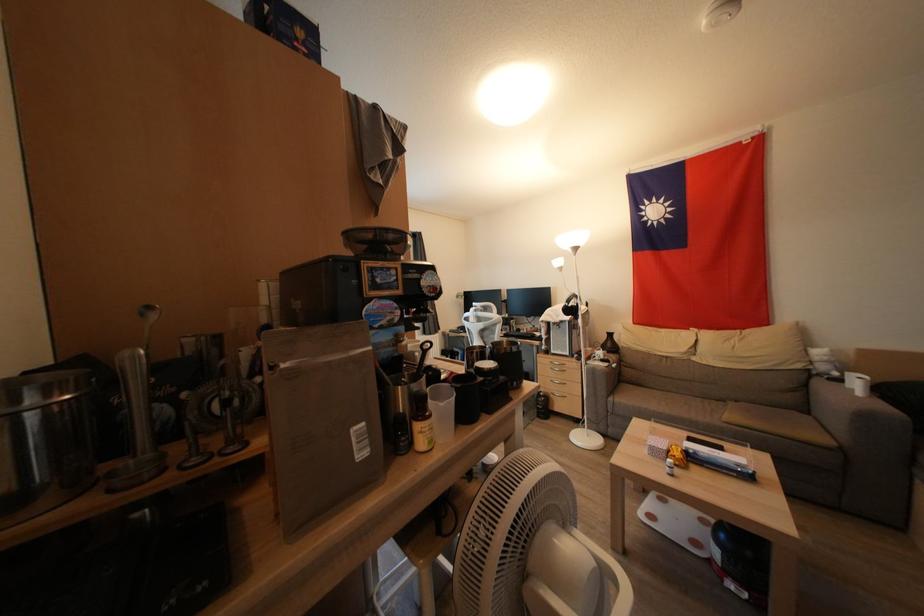
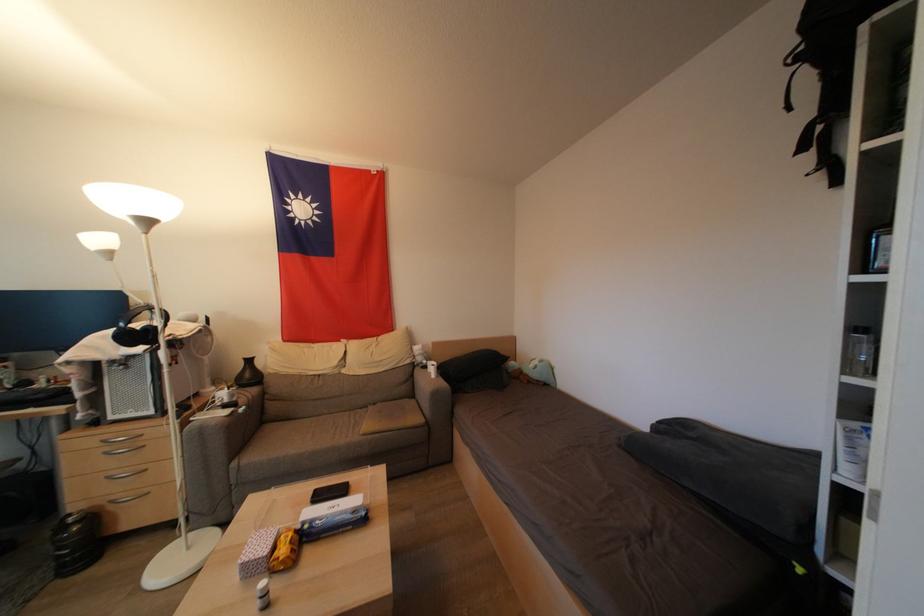
Find the pixel in the second image that matches point (696, 462) in the first image.

(310, 541)